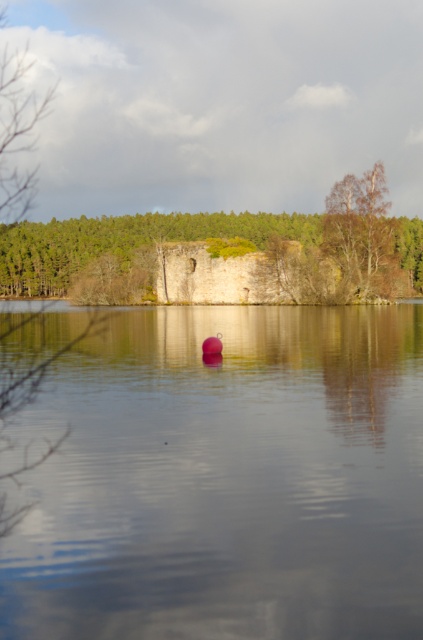
Question: Is smooth water at center below bare wood tree at right?

Choices:
 (A) yes
 (B) no

Answer: (A)

Question: Is smooth water at center above bare wood tree at right?

Choices:
 (A) yes
 (B) no

Answer: (B)

Question: Which object appears closest to the camera in this image?

Choices:
 (A) bare wood tree at right
 (B) smooth water at center

Answer: (B)

Question: Which of the following is the farthest from the observer?

Choices:
 (A) (329, 209)
 (B) (109, 504)

Answer: (A)

Question: Which object is farther from the camera taking this photo?

Choices:
 (A) bare wood tree at right
 (B) smooth water at center

Answer: (A)

Question: Can you confirm if smooth water at center is wider than bare wood tree at right?

Choices:
 (A) yes
 (B) no

Answer: (A)